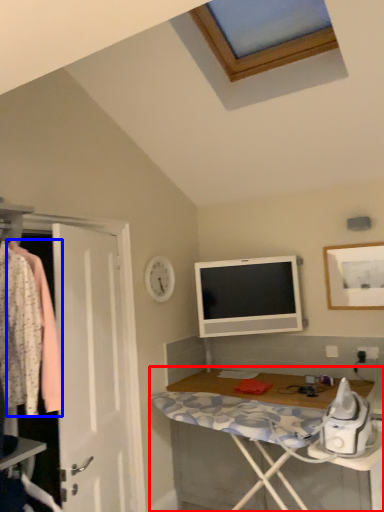
Question: Which object is further to the camera taking this photo, desk (highlighted by a red box) or clothing (highlighted by a blue box)?

Choices:
 (A) desk
 (B) clothing

Answer: (A)